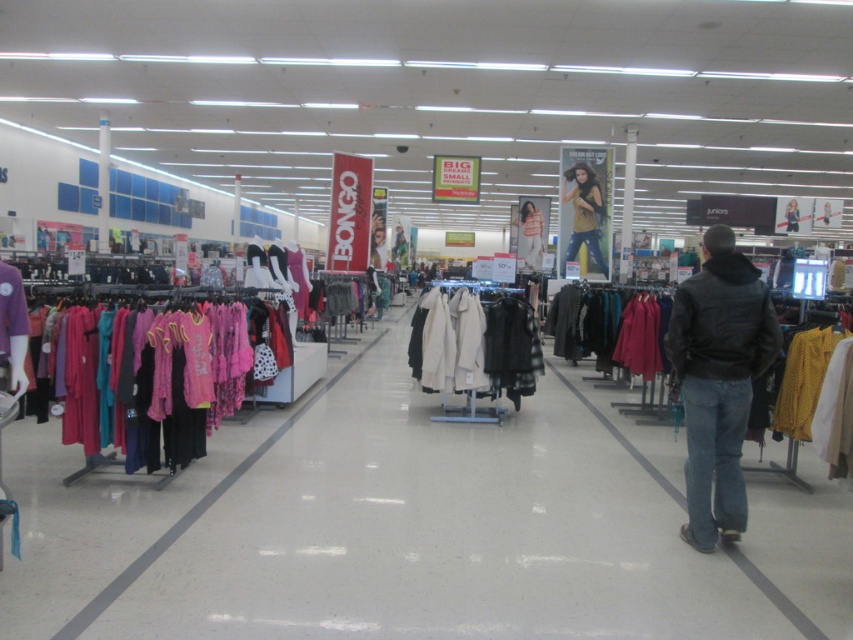
Question: In this image, where is black leather jacket at right located relative to black leather jacket at center?

Choices:
 (A) above
 (B) below

Answer: (B)

Question: Which of the following is the closest to the observer?

Choices:
 (A) black leather jacket at center
 (B) velvet maroon coat at center
 (C) white cotton jackets at center

Answer: (C)

Question: Can you confirm if white cotton jackets at center is positioned below matte white poster at center?

Choices:
 (A) yes
 (B) no

Answer: (A)

Question: Estimate the real-world distances between objects in this image. Which object is farther from the black leather jacket at right?

Choices:
 (A) black leather jacket at center
 (B) white cotton jackets at center
 (C) velvet maroon coat at center

Answer: (A)

Question: Estimate the real-world distances between objects in this image. Which object is farther from the black leather jacket at center?

Choices:
 (A) white cotton jackets at center
 (B) velvet maroon coat at center
 (C) matte white poster at center
 (D) matte yellow shirt at center

Answer: (A)

Question: Does black leather jacket at right have a greater width compared to white cotton jackets at center?

Choices:
 (A) no
 (B) yes

Answer: (A)